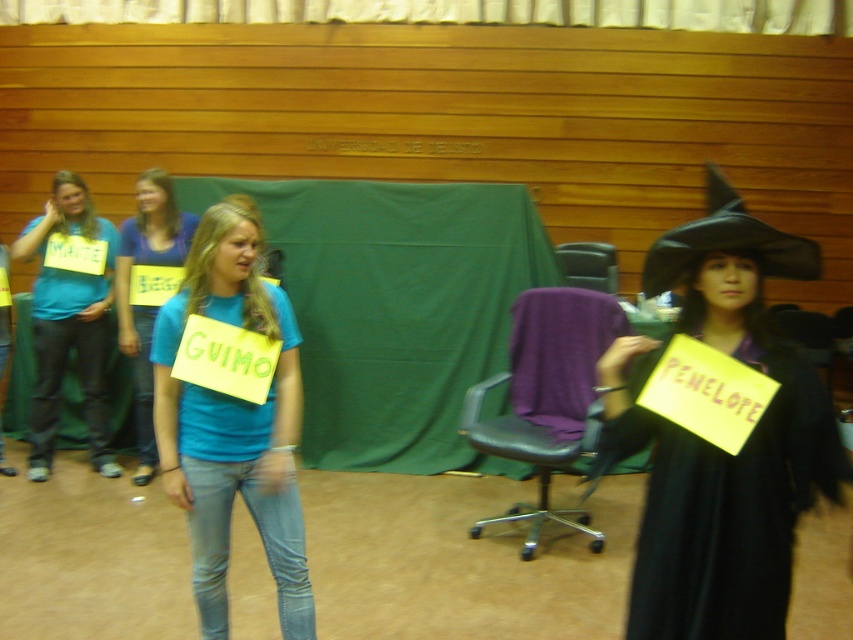
Who is taller, matte blue shirt at left or black felt witch hat at upper right?

matte blue shirt at left

Who is more forward, (x=88, y=417) or (x=653, y=275)?

Point (x=653, y=275)

Locate an element on the screen. This screenshot has width=853, height=640. matte blue shirt at left is located at coordinates (68, 316).

Is the position of blue cotton shirt at center more distant than that of matte blue shirt at left?

No.

Between point (209, 595) and point (48, 298), which one is positioned behind?

Point (48, 298)

Does point (207, 292) come farther from viewer compared to point (102, 230)?

No, it is not.

This screenshot has height=640, width=853. I want to click on blue cotton shirt at center, so click(x=233, y=424).

Does black felt witch hat at upper right have a lesser width compared to black leather chair at center?

Yes.

Is black felt witch hat at upper right wider than black leather chair at center?

In fact, black felt witch hat at upper right might be narrower than black leather chair at center.

This screenshot has width=853, height=640. Describe the element at coordinates (726, 243) in the screenshot. I see `black felt witch hat at upper right` at that location.

The height and width of the screenshot is (640, 853). I want to click on black felt witch hat at upper right, so click(x=726, y=243).